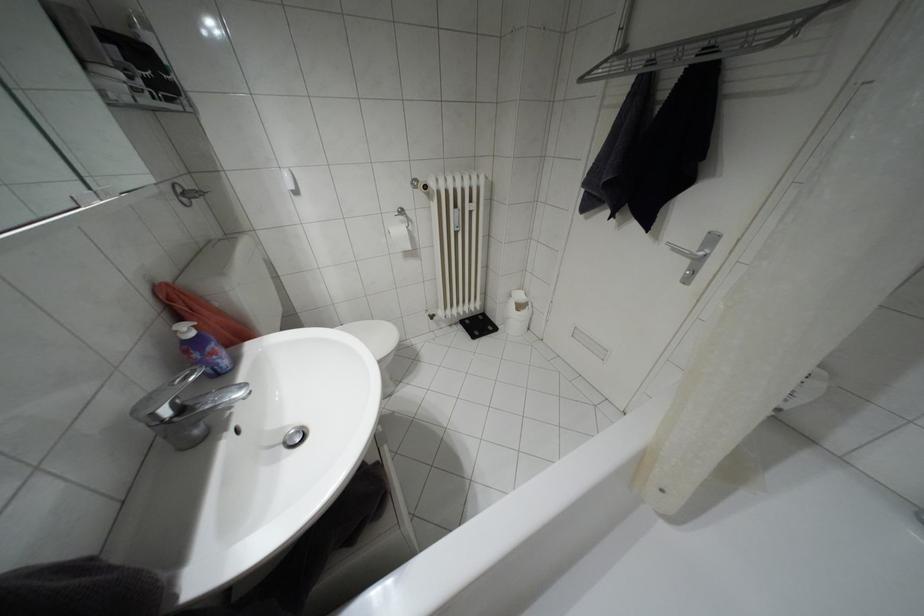
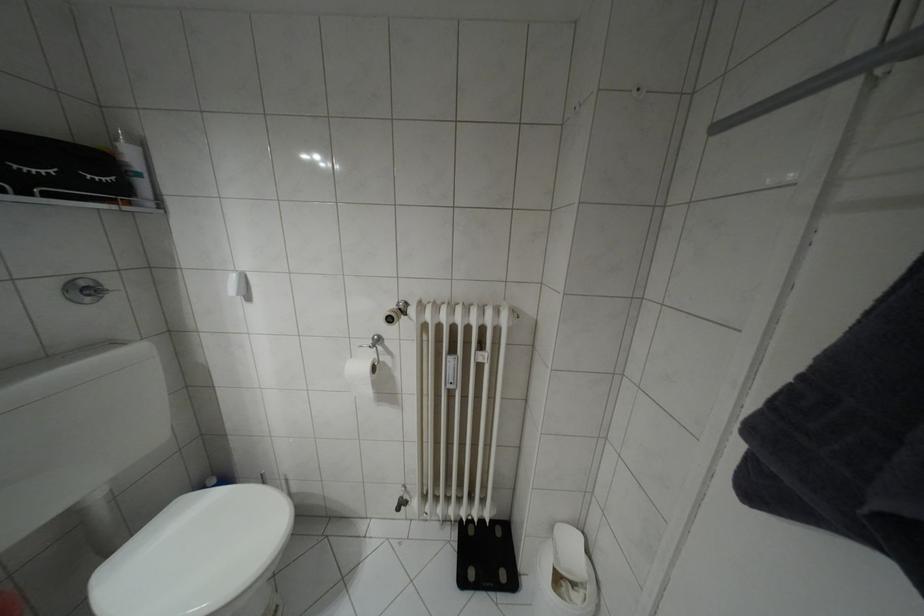
The point at (167, 100) is marked in the first image. Where is the corresponding point in the second image?

(49, 195)